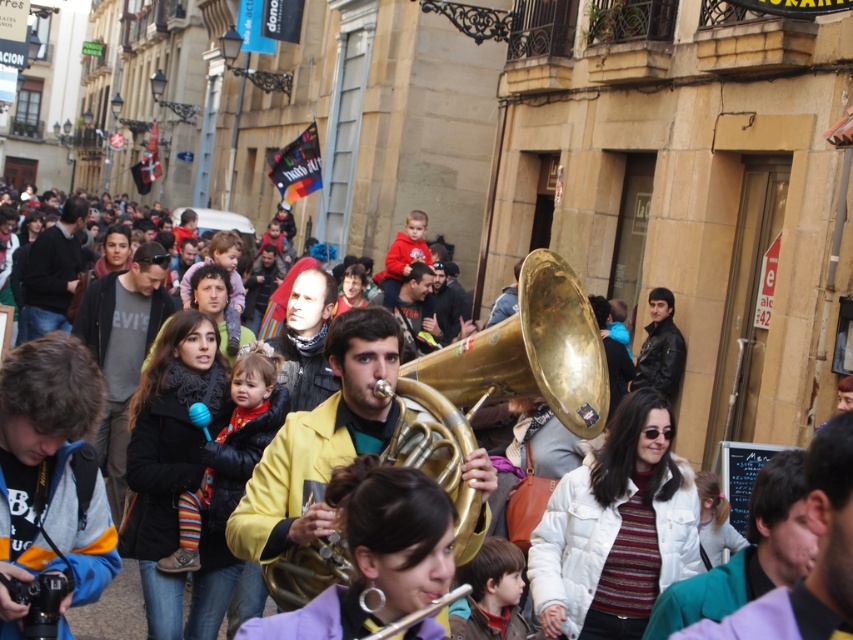
Question: Is gold brass trumpet at center above brown hair at center?

Choices:
 (A) no
 (B) yes

Answer: (B)

Question: Among these objects, which one is farthest from the camera?

Choices:
 (A) gold brass tuba at center
 (B) brown hair at center

Answer: (B)

Question: Which of the following is the farthest from the observer?

Choices:
 (A) [517, 339]
 (B) [181, 563]
 (C) [479, 557]

Answer: (A)

Question: Is gold brass trumpet at center wider than striped wool sweater at center?

Choices:
 (A) yes
 (B) no

Answer: (A)

Question: Is gold brass trumpet at center below gold brass tuba at center?

Choices:
 (A) no
 (B) yes

Answer: (B)

Question: Among these objects, which one is nearest to the camera?

Choices:
 (A) gold brass tuba at center
 (B) striped wool sweater at center

Answer: (A)